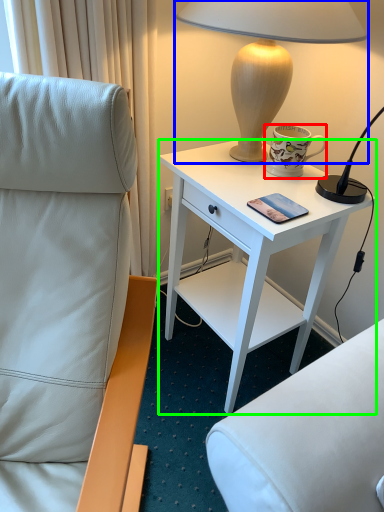
Question: Based on their relative distances, which object is nearer to coffee cup (highlighted by a red box)? Choose from lamp (highlighted by a blue box) and desk (highlighted by a green box).

Choices:
 (A) lamp
 (B) desk

Answer: (A)